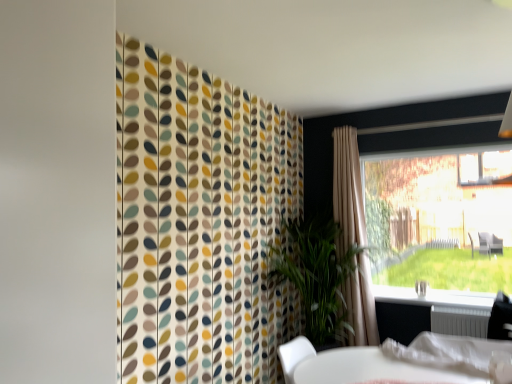
Find the location of a particular element. beige fabric curtain at right is located at coordinates (348, 189).

The image size is (512, 384). Describe the element at coordinates (317, 277) in the screenshot. I see `green leafy plant at center` at that location.

You are a GUI agent. You are given a task and a screenshot of the screen. Output one action in this format:
    pyautogui.click(x=<x>, y=<y>)
    Task: Click on the transparent glass window at right
    
    Given the screenshot: What is the action you would take?
    pyautogui.click(x=440, y=222)

Between white plastic bag at lower right and beige fabric curtain at right, which one has more height?

With more height is beige fabric curtain at right.

From the picture: Between white plastic bag at lower right and beige fabric curtain at right, which one has smaller width?

With smaller width is beige fabric curtain at right.

From the image's perspective, which one is positioned lower, white plastic bag at lower right or beige fabric curtain at right?

white plastic bag at lower right appears lower in the image.

Between white plastic bag at lower right and beige fabric curtain at right, which one appears on the right side from the viewer's perspective?

From the viewer's perspective, white plastic bag at lower right appears more on the right side.

From a real-world perspective, is transparent glass window at right positioned above or below white metallic radiator at lower right?

In terms of real-world spatial position, transparent glass window at right is above white metallic radiator at lower right.

Looking at this image, is transparent glass window at right smaller than white metallic radiator at lower right?

No, transparent glass window at right is not smaller than white metallic radiator at lower right.

Could you tell me if transparent glass window at right is facing white metallic radiator at lower right?

No, transparent glass window at right is not aimed at white metallic radiator at lower right.

Can you confirm if white plastic bag at lower right is taller than white metallic radiator at lower right?

Yes.

From a real-world perspective, does white plastic bag at lower right stand above white metallic radiator at lower right?

Yes, from a real-world perspective, white plastic bag at lower right is on top of white metallic radiator at lower right.

Between white plastic bag at lower right and white metallic radiator at lower right, which one is positioned in front?

Positioned in front is white plastic bag at lower right.

Who is more distant, beige fabric curtain at right or white metallic radiator at lower right?

beige fabric curtain at right.

Is beige fabric curtain at right shorter than white metallic radiator at lower right?

Incorrect, the height of beige fabric curtain at right does not fall short of that of white metallic radiator at lower right.

Considering the relative positions of beige fabric curtain at right and white metallic radiator at lower right in the image provided, is beige fabric curtain at right to the right of white metallic radiator at lower right from the viewer's perspective?

In fact, beige fabric curtain at right is to the left of white metallic radiator at lower right.

Does beige fabric curtain at right touch white metallic radiator at lower right?

No, beige fabric curtain at right is not next to white metallic radiator at lower right.

Who is taller, transparent glass window at right or beige fabric curtain at right?

beige fabric curtain at right is taller.

At what (x,y) coordinates should I click in order to perform the action: click on curtain located on the left of transparent glass window at right. Please return your answer as a coordinate pair (x, y). This screenshot has height=384, width=512. Looking at the image, I should click on (348, 189).

In the image, is transparent glass window at right on the left side or the right side of beige fabric curtain at right?

transparent glass window at right is to the right of beige fabric curtain at right.

Considering the relative sizes of green leafy plant at center and beige fabric curtain at right in the image provided, is green leafy plant at center smaller than beige fabric curtain at right?

No, green leafy plant at center is not smaller than beige fabric curtain at right.

What's the angular difference between green leafy plant at center and beige fabric curtain at right's facing directions?

There is a 1.86-degree angle between the facing directions of green leafy plant at center and beige fabric curtain at right.

Is point (309, 299) in front of point (376, 327)?

Yes, point (309, 299) is closer to viewer.

Which object is closer to the camera, green leafy plant at center or beige fabric curtain at right?

green leafy plant at center is closer to the camera.

From a real-world perspective, is white plastic bag at lower right over white plastic window sill at lower right?

No, from a real-world perspective, white plastic bag at lower right is not on top of white plastic window sill at lower right.

Is white plastic bag at lower right positioned far away from white plastic window sill at lower right?

Yes, white plastic bag at lower right and white plastic window sill at lower right are quite far apart.

Relative to white plastic window sill at lower right, is white plastic bag at lower right in front or behind?

Visually, white plastic bag at lower right is located in front of white plastic window sill at lower right.

I want to click on linen in front of the beige fabric curtain at right, so click(x=448, y=352).

This screenshot has width=512, height=384. I want to click on window located above the white metallic radiator at lower right (from the image's perspective), so click(440, 222).

Looking at this image, from the image, which object appears to be nearer to white plastic window sill at lower right, green leafy plant at center or white metallic radiator at lower right?

white metallic radiator at lower right is positioned closer to the anchor white plastic window sill at lower right.

Which object lies further to the anchor point green leafy plant at center, beige fabric curtain at right or white plastic window sill at lower right?

white plastic window sill at lower right is positioned further to the anchor green leafy plant at center.

When comparing their distances from green leafy plant at center, does beige fabric curtain at right or white metallic radiator at lower right seem further?

Based on the image, white metallic radiator at lower right appears to be further to green leafy plant at center.

Considering their positions, is beige fabric curtain at right positioned further to transparent glass window at right than white metallic radiator at lower right?

beige fabric curtain at right lies further to transparent glass window at right than the other object.

Which object lies further to the anchor point green leafy plant at center, white metallic radiator at lower right or white plastic bag at lower right?

Based on the image, white plastic bag at lower right appears to be further to green leafy plant at center.

Based on their spatial positions, is white plastic bag at lower right or white metallic radiator at lower right closer to beige fabric curtain at right?

white metallic radiator at lower right is positioned closer to the anchor beige fabric curtain at right.

When comparing their distances from beige fabric curtain at right, does transparent glass window at right or green leafy plant at center seem closer?

green leafy plant at center lies closer to beige fabric curtain at right than the other object.

From the image, which object appears to be farther from beige fabric curtain at right, green leafy plant at center or white metallic radiator at lower right?

white metallic radiator at lower right lies further to beige fabric curtain at right than the other object.

Identify the location of curtain between green leafy plant at center and transparent glass window at right from left to right. The height and width of the screenshot is (384, 512). (348, 189).

This screenshot has width=512, height=384. I want to click on radiator positioned between white plastic bag at lower right and white plastic window sill at lower right from near to far, so coord(460,321).

Locate an element on the screen. This screenshot has height=384, width=512. houseplant between white plastic bag at lower right and transparent glass window at right from front to back is located at coordinates (317, 277).

Where is `radiator positioned between white plastic bag at lower right and transparent glass window at right from near to far`? This screenshot has height=384, width=512. radiator positioned between white plastic bag at lower right and transparent glass window at right from near to far is located at coordinates (460, 321).